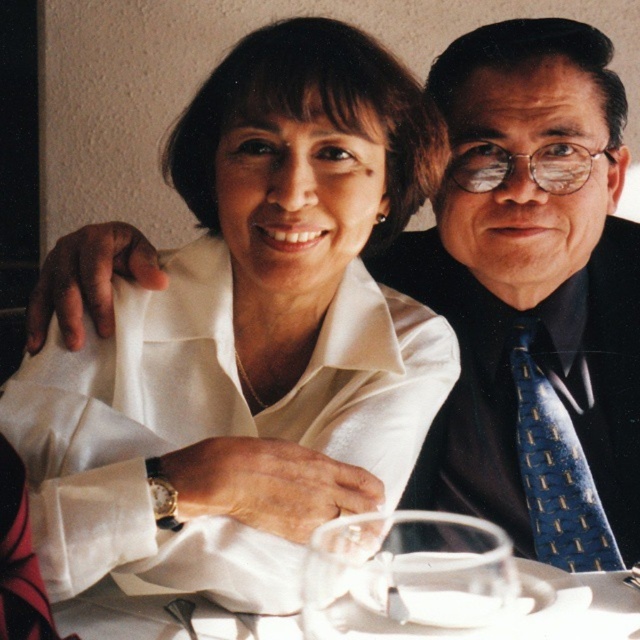
In the scene shown: Is blue textured tie at center in front of white glossy plate at center?

That is False.

Can you confirm if blue textured tie at center is shorter than white glossy plate at center?

No, blue textured tie at center is not shorter than white glossy plate at center.

You are a GUI agent. You are given a task and a screenshot of the screen. Output one action in this format:
    pyautogui.click(x=<x>, y=<y>)
    Task: Click on the blue textured tie at center
    
    Given the screenshot: What is the action you would take?
    [x=529, y=384]

Between satin white blouse at center and blue textured tie at center, which one appears on the right side from the viewer's perspective?

Positioned to the right is blue textured tie at center.

Image resolution: width=640 pixels, height=640 pixels. Describe the element at coordinates (248, 337) in the screenshot. I see `satin white blouse at center` at that location.

What do you see at coordinates (248, 337) in the screenshot? This screenshot has height=640, width=640. I see `satin white blouse at center` at bounding box center [248, 337].

You are a GUI agent. You are given a task and a screenshot of the screen. Output one action in this format:
    pyautogui.click(x=<x>, y=<y>)
    Task: Click on the satin white blouse at center
    The image size is (640, 640).
    Given the screenshot: What is the action you would take?
    pyautogui.click(x=248, y=337)

Does blue textured tie at center appear over blue textured tie at right?

Yes.

Is blue textured tie at center to the left of blue textured tie at right from the viewer's perspective?

Correct, you'll find blue textured tie at center to the left of blue textured tie at right.

Does point (588, 406) come closer to viewer compared to point (529, 470)?

That is False.

The height and width of the screenshot is (640, 640). Find the location of `blue textured tie at center`. blue textured tie at center is located at coordinates (529, 384).